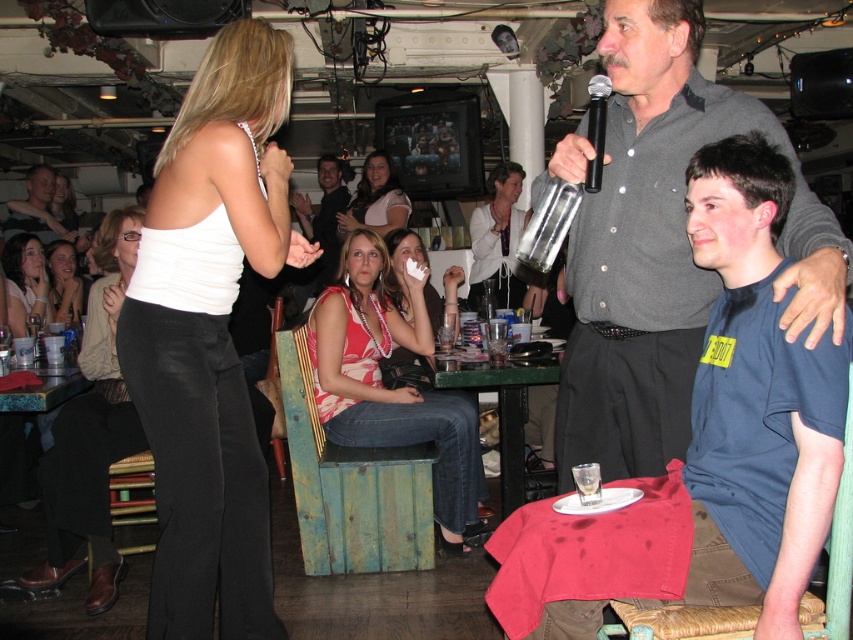
Which is in front, point (437, 406) or point (300, 209)?

Point (437, 406) is more forward.

Is floral tank top at center to the left of dark gray shirt at center from the viewer's perspective?

In fact, floral tank top at center is to the right of dark gray shirt at center.

Between point (469, 476) and point (300, 209), which one is positioned in front?

Positioned in front is point (469, 476).

Find the location of `floral tank top at center`. floral tank top at center is located at coordinates (393, 388).

Between matte black pants at lower left and matte pink top at center, which one is positioned lower?

matte black pants at lower left

Which is more to the right, matte black pants at lower left or matte pink top at center?

From the viewer's perspective, matte pink top at center appears more on the right side.

Between point (115, 392) and point (399, 268), which one is positioned behind?

Positioned behind is point (399, 268).

Where is `matte black pants at lower left`? Image resolution: width=853 pixels, height=640 pixels. matte black pants at lower left is located at coordinates (91, 433).

Is white pearl necklace at center above matte pink top at center?

Yes.

Is point (498, 256) less distant than point (456, 289)?

No.

The image size is (853, 640). I want to click on white pearl necklace at center, so click(498, 237).